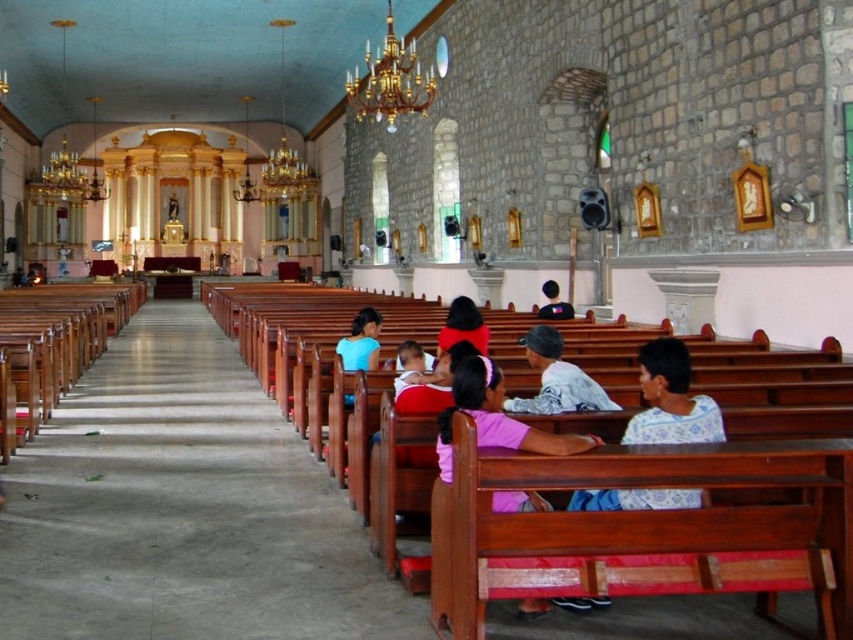
Question: Observing the image, what is the correct spatial positioning of matte blue shirt at center in reference to black fabric shirt at center?

Choices:
 (A) left
 (B) right

Answer: (A)

Question: Where is matte blue shirt at center located in relation to matte red shirt at center in the image?

Choices:
 (A) right
 (B) left

Answer: (B)

Question: Which point appears farthest from the camera in this image?

Choices:
 (A) (474, 340)
 (B) (543, 312)

Answer: (B)

Question: Which object is the closest to the black fabric shirt at center?

Choices:
 (A) matte red shirt at center
 (B) pink fabric at lower center
 (C) matte blue shirt at center

Answer: (A)

Question: Is pink fabric at lower center to the left of white cotton shirt at center from the viewer's perspective?

Choices:
 (A) yes
 (B) no

Answer: (A)

Question: Which object is farther from the camera taking this photo?

Choices:
 (A) white cotton shirt at center
 (B) pink fabric at lower center
 (C) black fabric shirt at center
 (D) matte red shirt at center

Answer: (C)